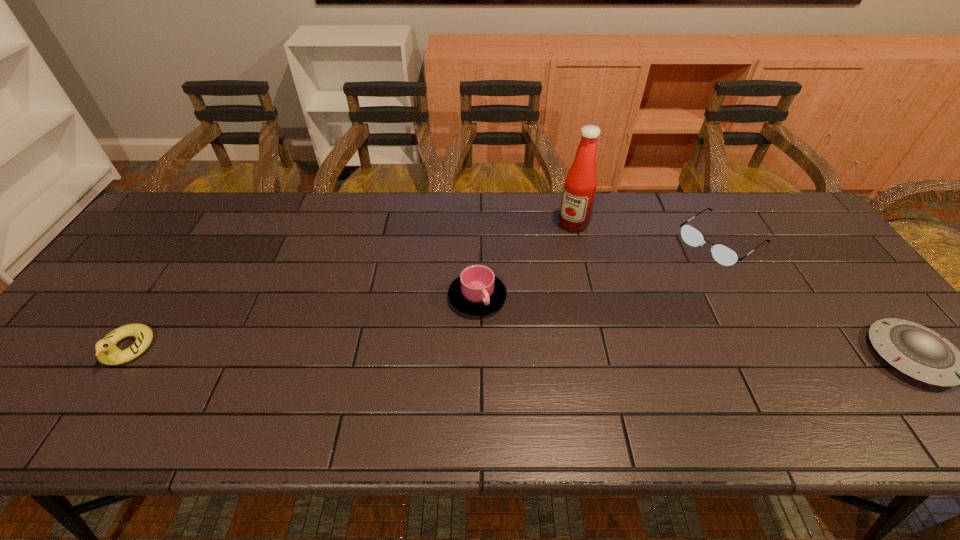
Locate an element on the screen. This screenshot has width=960, height=540. object that is at the left edge is located at coordinates (107, 352).

Identify the location of object present at the near left corner. The height and width of the screenshot is (540, 960). (107, 352).

At what (x,y) coordinates should I click in order to perform the action: click on vacant space at the far edge. Please return your answer as a coordinate pair (x, y). Looking at the image, I should click on (626, 205).

This screenshot has width=960, height=540. I want to click on vacant region at the near edge of the desktop, so click(682, 364).

Identify the location of vacant space at the left edge. The width and height of the screenshot is (960, 540). (180, 248).

Find the location of `vacant space at the right edge of the desktop`. vacant space at the right edge of the desktop is located at coordinates coord(821,320).

Identify the location of vacant area at the far right corner. (787, 210).

Locate an element on the screen. Image resolution: width=960 pixels, height=540 pixels. free space at the near right corner of the desktop is located at coordinates (898, 379).

At what (x,y) coordinates should I click in order to perform the action: click on blank region between the tallest object and the leftmost object. Please return your answer as a coordinate pair (x, y). The height and width of the screenshot is (540, 960). Looking at the image, I should click on (350, 286).

The height and width of the screenshot is (540, 960). In order to click on free area in between the fourth object from left to right and the condiment in this screenshot , I will do `click(647, 232)`.